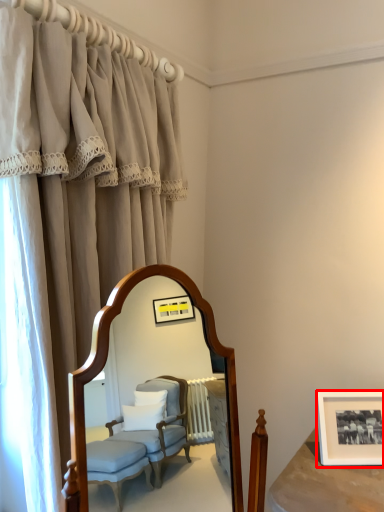
Question: From the image, what is the correct spatial relationship of picture frame (annotated by the red box) in relation to curtain?

Choices:
 (A) right
 (B) left

Answer: (A)